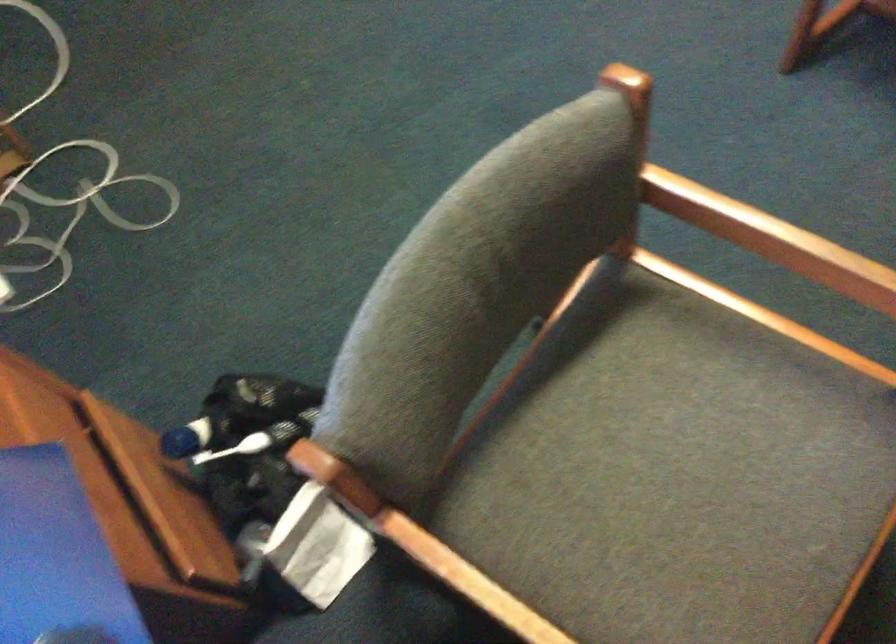
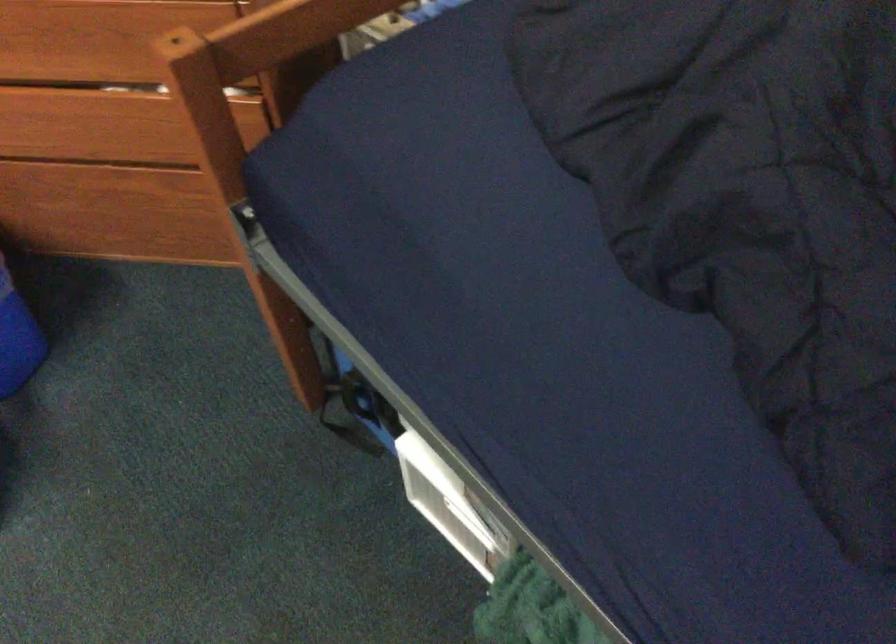
The first image is from the beginning of the video and the second image is from the end. How did the camera likely rotate when shooting the video?

The camera's rotation is toward right-down.